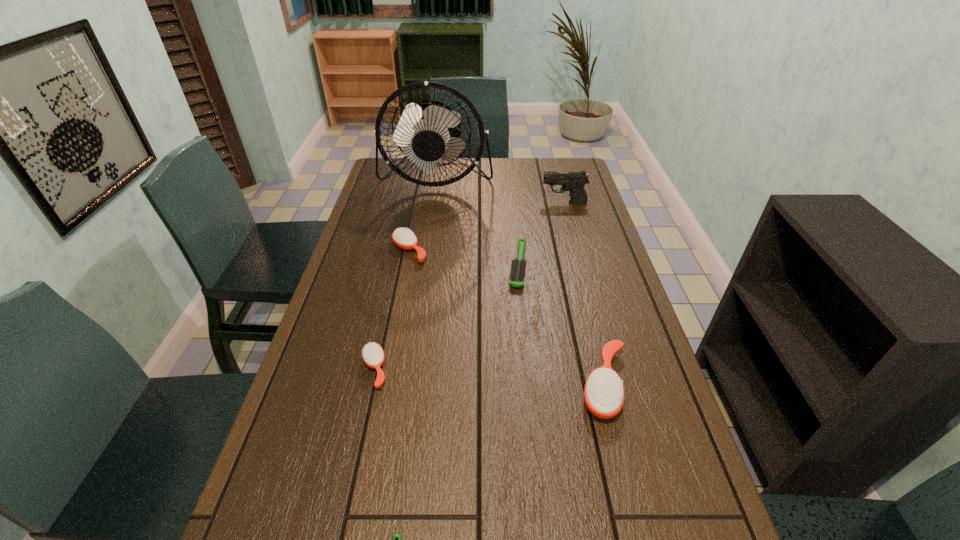
I want to click on black fan, so click(x=426, y=132).

The height and width of the screenshot is (540, 960). I want to click on fan, so click(426, 132).

Image resolution: width=960 pixels, height=540 pixels. What are the coordinates of `the second tallest object` in the screenshot? It's located at (574, 182).

Identify the location of pistol. This screenshot has width=960, height=540. (574, 182).

This screenshot has width=960, height=540. Find the location of `the rightmost hairbrush`. the rightmost hairbrush is located at coordinates (604, 392).

The width and height of the screenshot is (960, 540). Find the location of `the fifth shortest object`. the fifth shortest object is located at coordinates (604, 392).

Find the location of a particular element. the second biggest orange hairbrush is located at coordinates (404, 238).

Where is `the farthest orange hairbrush`? This screenshot has width=960, height=540. the farthest orange hairbrush is located at coordinates (404, 238).

The height and width of the screenshot is (540, 960). In order to click on the bigger light hairbrush in this screenshot , I will do `click(517, 273)`.

Find the location of `the fifth object from left to right`. the fifth object from left to right is located at coordinates (517, 273).